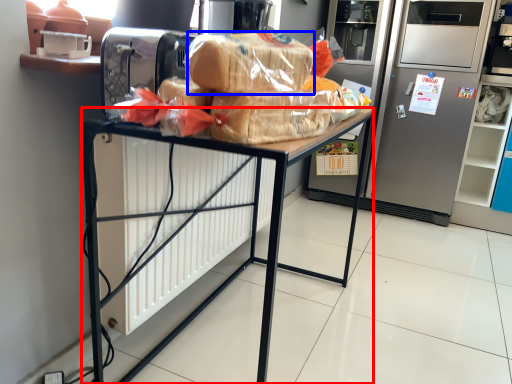
Question: Which object appears closest to the camera in this image, desk (highlighted by a red box) or bread (highlighted by a blue box)?

Choices:
 (A) desk
 (B) bread

Answer: (B)